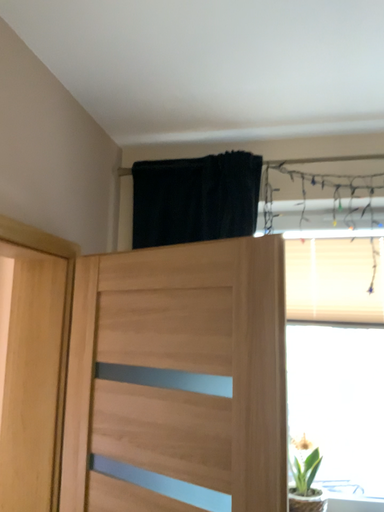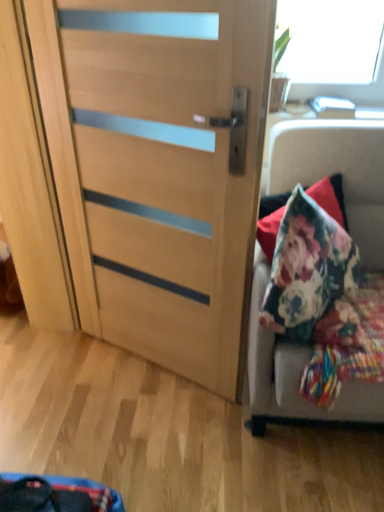
Question: How did the camera likely rotate when shooting the video?

Choices:
 (A) rotated upward
 (B) rotated downward

Answer: (B)